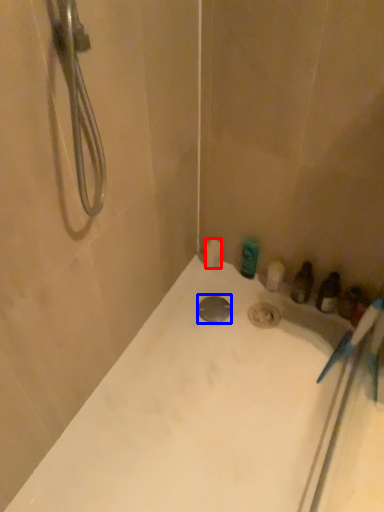
Question: Which point is closer to the camera, toilet paper (highlighted by a red box) or drain (highlighted by a blue box)?

Choices:
 (A) toilet paper
 (B) drain

Answer: (B)